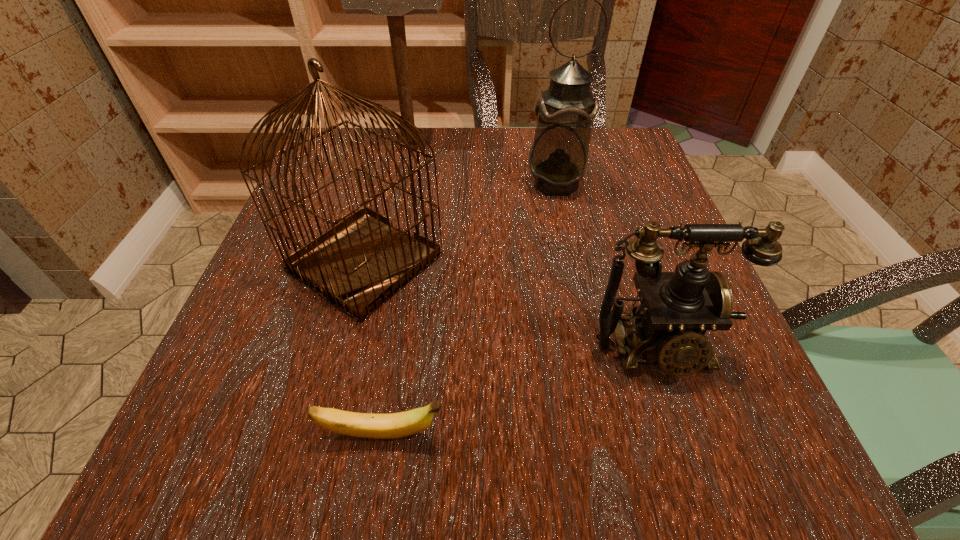
The height and width of the screenshot is (540, 960). In order to click on vacant space at the far edge of the desktop in this screenshot , I will do `click(466, 140)`.

Identify the location of vacant space at the near edge of the desktop. The image size is (960, 540). [x=580, y=470].

This screenshot has height=540, width=960. I want to click on vacant point at the left edge, so click(264, 267).

This screenshot has height=540, width=960. In the image, there is a desktop. Find the location of `free region at the far left corner`. free region at the far left corner is located at coordinates tap(372, 172).

In the image, there is a desktop. Where is `free region at the near left corner`? The image size is (960, 540). free region at the near left corner is located at coordinates (257, 483).

Locate an element on the screen. The height and width of the screenshot is (540, 960). vacant area between the birdcage and the oil lamp is located at coordinates [460, 223].

What are the coordinates of `vacant point located between the oil lamp and the mallet` in the screenshot? It's located at (483, 162).

Where is `vacant area that lies between the oil lamp and the shortest object`? vacant area that lies between the oil lamp and the shortest object is located at coordinates pyautogui.click(x=469, y=309).

You are a GUI agent. You are given a task and a screenshot of the screen. Output one action in this format:
    pyautogui.click(x=<x>, y=<y>)
    Task: Click on the vacant region between the fourth nearest object and the telephone
    This screenshot has width=960, height=540.
    Given the screenshot: What is the action you would take?
    pyautogui.click(x=606, y=266)

Locate an element on the screen. empty space that is in between the telephone and the nearest object is located at coordinates (519, 392).